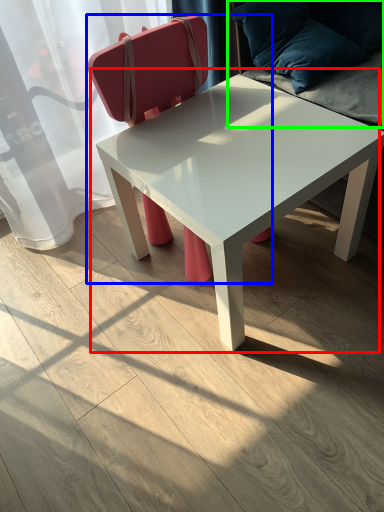
Question: Considering the real-world distances, which object is closest to coffee table (highlighted by a red box)? chair (highlighted by a blue box) or swivel chair (highlighted by a green box).

Choices:
 (A) chair
 (B) swivel chair

Answer: (B)